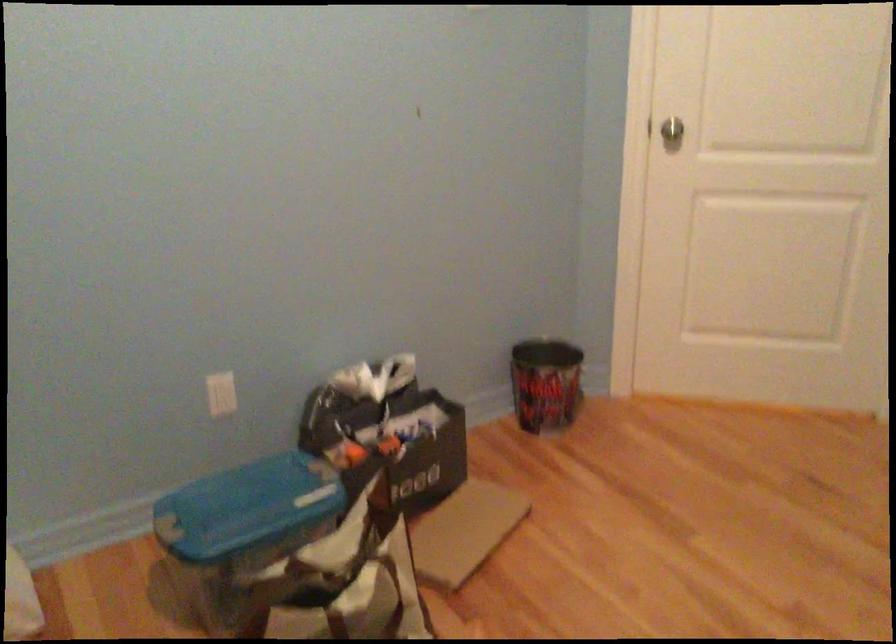
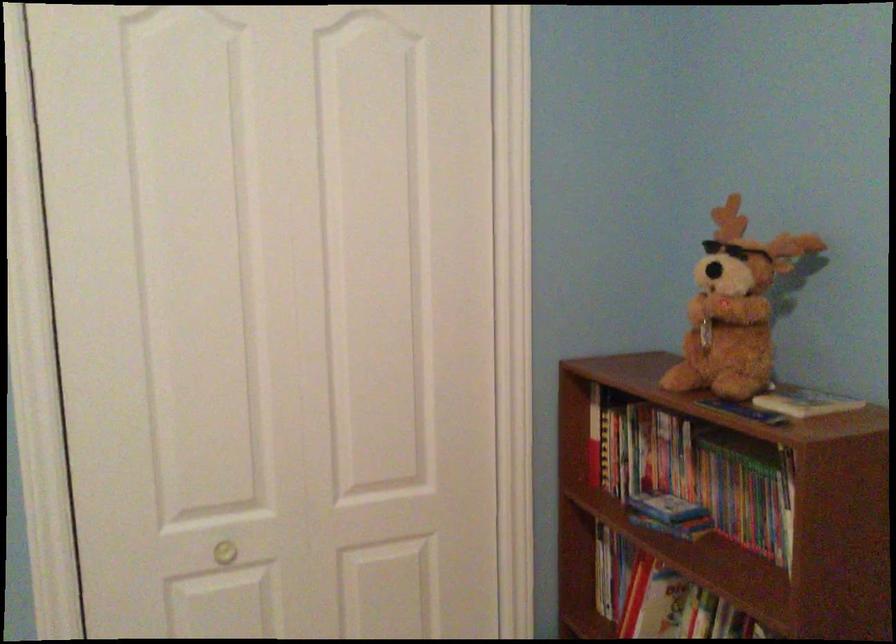
Question: Based on the continuous images, in which direction is the camera rotating? Reply with the corresponding letter.

Choices:
 (A) Left
 (B) Right
 (C) Up
 (D) Down

Answer: (B)